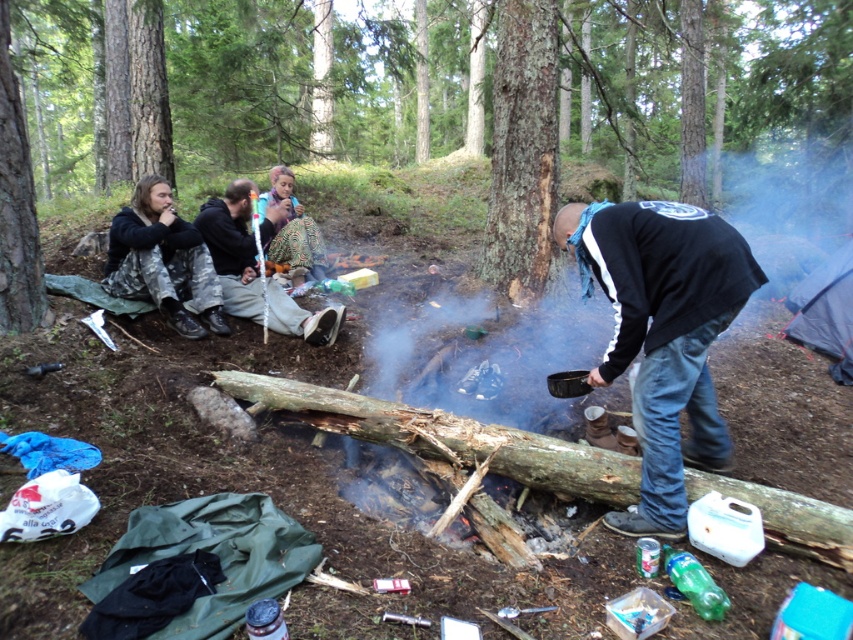
Question: Which point is closer to the camera taking this photo?

Choices:
 (A) (234, 280)
 (B) (292, 176)
 (C) (850, 353)

Answer: (A)

Question: Observing the image, what is the correct spatial positioning of camouflage pants at left in reference to blue fabric tent at right?

Choices:
 (A) left
 (B) right

Answer: (A)

Question: Which point appears farthest from the camera in this image?

Choices:
 (A) (827, 353)
 (B) (276, 259)
 (C) (137, 211)

Answer: (B)

Question: Is the position of blue fabric tent at right less distant than that of patterned fabric skirt at center?

Choices:
 (A) no
 (B) yes

Answer: (B)

Question: Among these points, which one is nearest to the camera?

Choices:
 (A) (712, 163)
 (B) (167, 221)
 (C) (259, 291)

Answer: (B)

Question: Does camouflage pants at left appear on the left side of blue fabric tent at right?

Choices:
 (A) no
 (B) yes

Answer: (B)